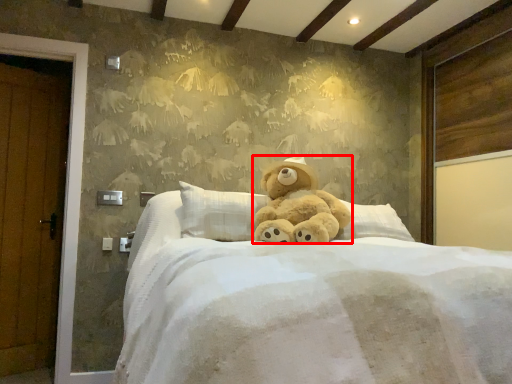
Question: From the image's perspective, what is the correct spatial positioning of teddy bear (annotated by the red box) in reference to bed?

Choices:
 (A) below
 (B) above

Answer: (B)